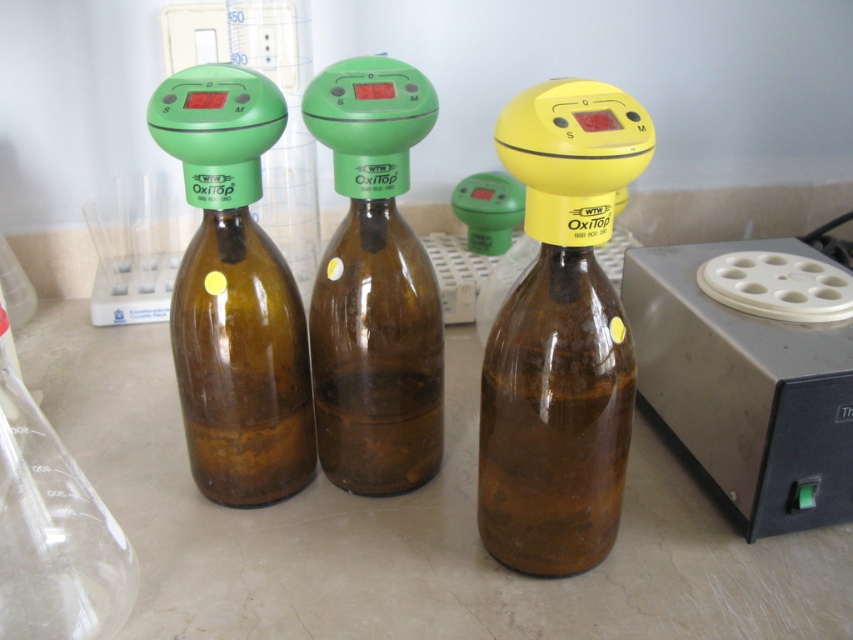
Can you confirm if yellow matte bottle at center is positioned to the left of brown glass bottle at center?

Incorrect, yellow matte bottle at center is not on the left side of brown glass bottle at center.

Based on the photo, does yellow matte bottle at center have a lesser height compared to brown glass bottle at center?

Correct, yellow matte bottle at center is not as tall as brown glass bottle at center.

Who is more forward, (x=567, y=483) or (x=238, y=364)?

Point (x=567, y=483)

This screenshot has width=853, height=640. Identify the location of yellow matte bottle at center. (560, 336).

Does gray plastic centrifuge at right appear on the right side of brown glass bottle at center?

Yes, gray plastic centrifuge at right is to the right of brown glass bottle at center.

Does gray plastic centrifuge at right appear on the left side of brown glass bottle at center?

In fact, gray plastic centrifuge at right is to the right of brown glass bottle at center.

This screenshot has height=640, width=853. Describe the element at coordinates (750, 371) in the screenshot. I see `gray plastic centrifuge at right` at that location.

Where is `gray plastic centrifuge at right`? The width and height of the screenshot is (853, 640). gray plastic centrifuge at right is located at coordinates (750, 371).

Who is shorter, gray plastic centrifuge at right or green matte bottle at center?

With less height is gray plastic centrifuge at right.

Can you confirm if gray plastic centrifuge at right is taller than green matte bottle at center?

No, gray plastic centrifuge at right is not taller than green matte bottle at center.

Is point (805, 456) closer to camera compared to point (363, 97)?

No, it is behind (363, 97).

Locate an element on the screen. gray plastic centrifuge at right is located at coordinates (750, 371).